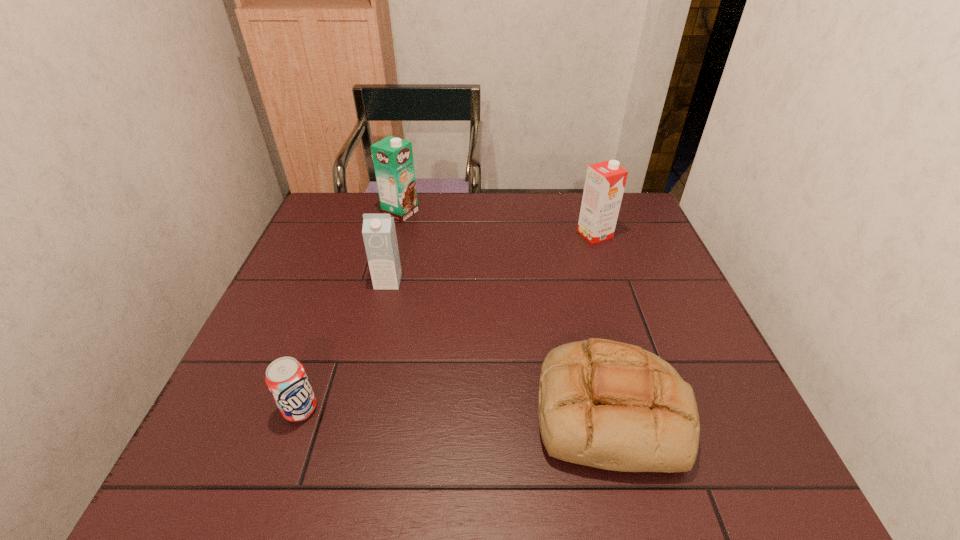
Identify the location of vacant space located on the back of the leftmost object. (348, 274).

Locate an element on the screen. The image size is (960, 540). object positioned at the near edge is located at coordinates (610, 405).

The width and height of the screenshot is (960, 540). I want to click on object at the left edge, so click(x=286, y=378).

Where is `carton that is at the right edge`? This screenshot has height=540, width=960. carton that is at the right edge is located at coordinates (604, 186).

The width and height of the screenshot is (960, 540). What are the coordinates of `bread positioned at the right edge` in the screenshot? It's located at (610, 405).

Find the location of `object situated at the far right corner`. object situated at the far right corner is located at coordinates (604, 186).

Where is `object present at the near right corner`? object present at the near right corner is located at coordinates (610, 405).

Locate an element on the screen. The height and width of the screenshot is (540, 960). free region at the far edge of the desktop is located at coordinates tap(431, 209).

You are a GUI agent. You are given a task and a screenshot of the screen. Output one action in this format:
    pyautogui.click(x=<x>, y=<y>)
    Task: Click on the vacant space at the near edge of the desktop
    
    Given the screenshot: What is the action you would take?
    pyautogui.click(x=471, y=477)

At what (x,y) coordinates should I click in order to perform the action: click on vacant space at the left edge of the desktop. Please return your answer as a coordinate pair (x, y). This screenshot has width=960, height=540. Looking at the image, I should click on (295, 314).